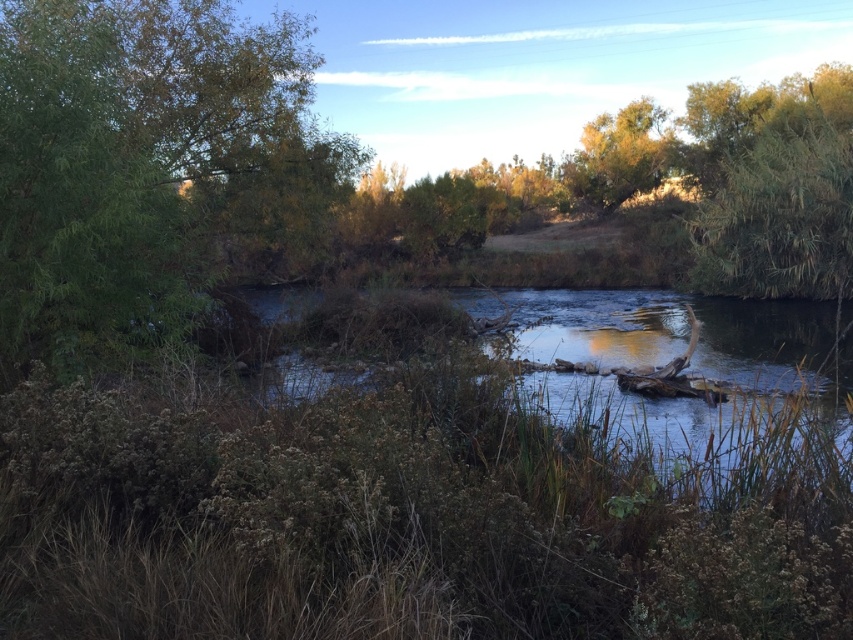
Which of these two, smooth brown water at center or green leafy tree at upper right, stands taller?

With more height is green leafy tree at upper right.

Looking at this image, can you confirm if smooth brown water at center is bigger than green leafy tree at upper right?

Correct, smooth brown water at center is larger in size than green leafy tree at upper right.

Between point (848, 316) and point (627, 172), which one is positioned behind?

The point (627, 172) is more distant.

This screenshot has height=640, width=853. What are the coordinates of `smooth brown water at center` in the screenshot? It's located at (688, 371).

Does green leafy tree at left have a greater width compared to smooth brown water at center?

Incorrect, green leafy tree at left's width does not surpass smooth brown water at center's.

In order to click on green leafy tree at left in this screenshot , I will do 144,163.

Which is in front, point (151, 264) or point (635, 164)?

Point (151, 264)

Who is taller, green leafy tree at left or green leafy tree at upper right?

With more height is green leafy tree at upper right.

Is point (236, 168) positioned before point (614, 204)?

Yes, point (236, 168) is closer to viewer.

Find the location of `green leafy tree at left`. green leafy tree at left is located at coordinates (144, 163).